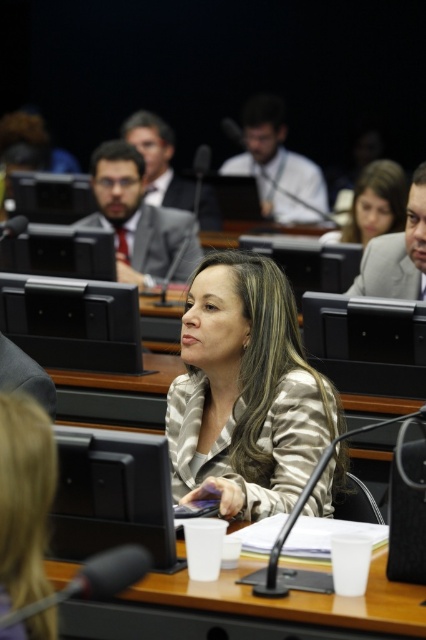
Question: Which point is closer to the camera taking this photo?

Choices:
 (A) (267, 337)
 (B) (154, 276)

Answer: (A)

Question: Which object is closer to the camera taking this photo?

Choices:
 (A) silky beige blazer at center
 (B) matte gold blouse at upper center

Answer: (A)

Question: Which point appears closest to the camera in this image?

Choices:
 (A) (175, 577)
 (B) (360, 196)
 (C) (198, 282)

Answer: (A)

Question: Does white plastic cups at center have a lesser width compared to matte gray suit at upper left?

Choices:
 (A) yes
 (B) no

Answer: (B)

Question: Does silky beige blazer at center have a smaller size compared to matte gold blouse at upper center?

Choices:
 (A) yes
 (B) no

Answer: (A)

Question: Can you confirm if silky beige blazer at center is positioned to the left of matte gray suit at upper left?

Choices:
 (A) yes
 (B) no

Answer: (B)